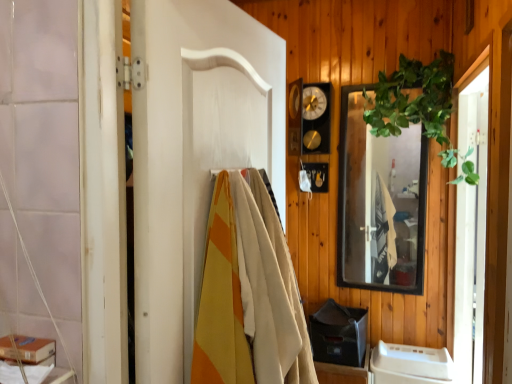
Where is `black glass mirror at upper right`? This screenshot has height=384, width=512. black glass mirror at upper right is located at coordinates (380, 202).

Describe the element at coordinates (415, 102) in the screenshot. I see `green leafy plant at upper right` at that location.

What do you see at coordinates (412, 363) in the screenshot?
I see `white plastic container at lower right` at bounding box center [412, 363].

Where is `black glass mirror at upper right`? black glass mirror at upper right is located at coordinates (380, 202).

Is white painted wood door at center positioned in front of transparent glass screen door at right?

Yes, white painted wood door at center is closer to the viewer.

Is white painted wood door at center thinner than transparent glass screen door at right?

Yes.

Is white painted wood door at center oriented away from transparent glass screen door at right?

No.

Are white painted wood door at center and transparent glass screen door at right making contact?

No, white painted wood door at center is not beside transparent glass screen door at right.

Consider the image. Between white plastic container at lower right and white painted wood door at center, which one has smaller width?

Thinner between the two is white painted wood door at center.

From a real-world perspective, is white plastic container at lower right positioned above or below white painted wood door at center?

From a real-world perspective, white plastic container at lower right is physically below white painted wood door at center.

Considering the relative sizes of white plastic container at lower right and white painted wood door at center in the image provided, is white plastic container at lower right shorter than white painted wood door at center?

Indeed, white plastic container at lower right has a lesser height compared to white painted wood door at center.

Is white plastic container at lower right outside of white painted wood door at center?

Yes, white plastic container at lower right is outside of white painted wood door at center.

Is transparent glass screen door at right not inside white painted wood door at center?

transparent glass screen door at right lies outside white painted wood door at center's area.

Considering the sizes of objects transparent glass screen door at right and white painted wood door at center in the image provided, who is taller, transparent glass screen door at right or white painted wood door at center?

With more height is transparent glass screen door at right.

Does point (477, 206) come farther from viewer compared to point (279, 88)?

Yes, point (477, 206) is farther from viewer.

In the scene shown: Can you confirm if transparent glass screen door at right is thinner than white painted wood door at center?

No.

From a real-world perspective, between white painted wood door at center and green leafy plant at upper right, who is vertically higher?

In real-world perspective, green leafy plant at upper right is above.

Find the location of a particular element. The height and width of the screenshot is (384, 512). plant on the right of white painted wood door at center is located at coordinates (415, 102).

Which is in front, point (170, 52) or point (439, 138)?

The point (170, 52) is more forward.

Based on the photo, from the image's perspective, is white painted wood door at center beneath green leafy plant at upper right?

Correct, white painted wood door at center appears lower than green leafy plant at upper right in the image.

From a real-world perspective, relative to green leafy plant at upper right, is black glass mirror at upper right vertically above or below?

In terms of real-world spatial position, black glass mirror at upper right is below green leafy plant at upper right.

Considering the sizes of objects black glass mirror at upper right and green leafy plant at upper right in the image provided, who is shorter, black glass mirror at upper right or green leafy plant at upper right?

Standing shorter between the two is green leafy plant at upper right.

Is black glass mirror at upper right inside or outside of green leafy plant at upper right?

black glass mirror at upper right lies within the bounds of green leafy plant at upper right.

Considering the relative sizes of black glass mirror at upper right and green leafy plant at upper right in the image provided, is black glass mirror at upper right thinner than green leafy plant at upper right?

Yes, black glass mirror at upper right is thinner than green leafy plant at upper right.

Does point (403, 186) appear closer or farther from the camera than point (451, 377)?

Clearly, point (403, 186) is more distant from the camera than point (451, 377).

Between black glass mirror at upper right and white plastic container at lower right, which one appears on the left side from the viewer's perspective?

Positioned to the left is black glass mirror at upper right.

Does black glass mirror at upper right contain white plastic container at lower right?

No, white plastic container at lower right is located outside of black glass mirror at upper right.

From the image's perspective, is black glass mirror at upper right located above or below white plastic container at lower right?

black glass mirror at upper right is above white plastic container at lower right.

Is black glass mirror at upper right in front of or behind white painted wood door at center in the image?

In the image, black glass mirror at upper right appears behind white painted wood door at center.

Where is `door in front of the black glass mirror at upper right`? The image size is (512, 384). door in front of the black glass mirror at upper right is located at coordinates (194, 154).

From a real-world perspective, is black glass mirror at upper right above or below white painted wood door at center?

black glass mirror at upper right is situated lower than white painted wood door at center in the real world.

Is black glass mirror at upper right not close to white painted wood door at center?

Absolutely, black glass mirror at upper right is distant from white painted wood door at center.

What are the coordinates of `screen door on the right of the white painted wood door at center` in the screenshot? It's located at (471, 223).

The image size is (512, 384). I want to click on door on the left of white plastic container at lower right, so click(194, 154).

When comparing their distances from white painted wood door at center, does black glass mirror at upper right or green leafy plant at upper right seem further?

green leafy plant at upper right lies further to white painted wood door at center than the other object.

Which object lies further to the anchor point green leafy plant at upper right, transparent glass screen door at right or white painted wood door at center?

white painted wood door at center.

Estimate the real-world distances between objects in this image. Which object is closer to green leafy plant at upper right, white painted wood door at center or transparent glass screen door at right?

Among the two, transparent glass screen door at right is located nearer to green leafy plant at upper right.

Based on their spatial positions, is transparent glass screen door at right or black glass mirror at upper right further from green leafy plant at upper right?

transparent glass screen door at right is further to green leafy plant at upper right.

Looking at the image, which one is located closer to white plastic container at lower right, green leafy plant at upper right or white painted wood door at center?

green leafy plant at upper right is closer to white plastic container at lower right.

Considering their positions, is white plastic container at lower right positioned closer to white painted wood door at center than transparent glass screen door at right?

The object closer to white painted wood door at center is transparent glass screen door at right.

When comparing their distances from transparent glass screen door at right, does black glass mirror at upper right or white plastic container at lower right seem closer?

black glass mirror at upper right is positioned closer to the anchor transparent glass screen door at right.

From the picture: Estimate the real-world distances between objects in this image. Which object is closer to green leafy plant at upper right, black glass mirror at upper right or transparent glass screen door at right?

black glass mirror at upper right is closer to green leafy plant at upper right.

Where is `screen door between green leafy plant at upper right and white plastic container at lower right from top to bottom`? The image size is (512, 384). screen door between green leafy plant at upper right and white plastic container at lower right from top to bottom is located at coordinates (471, 223).

Where is `door between green leafy plant at upper right and white plastic container at lower right vertically`? door between green leafy plant at upper right and white plastic container at lower right vertically is located at coordinates (194, 154).

Identify the location of mirror between green leafy plant at upper right and white plastic container at lower right in the up-down direction. Image resolution: width=512 pixels, height=384 pixels. (380, 202).

At what (x,y) coordinates should I click in order to perform the action: click on appliance located between white painted wood door at center and black glass mirror at upper right in the depth direction. Please return your answer as a coordinate pair (x, y). This screenshot has width=512, height=384. Looking at the image, I should click on (412, 363).